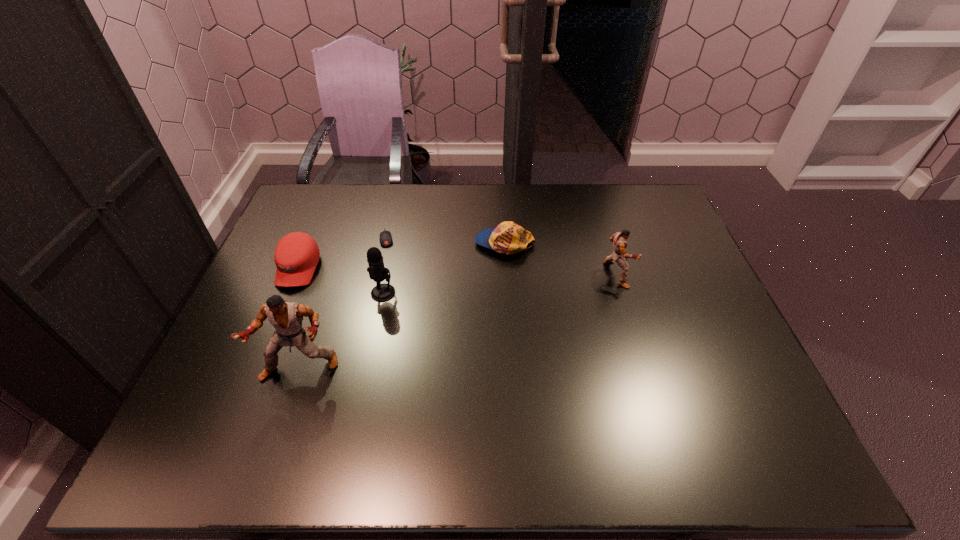
Locate an element on the screen. free location that satisfies the following two spatial constraints: 1. on the bill of the fifth object from left to right; 2. on the front-facing side of the left cap is located at coordinates (506, 269).